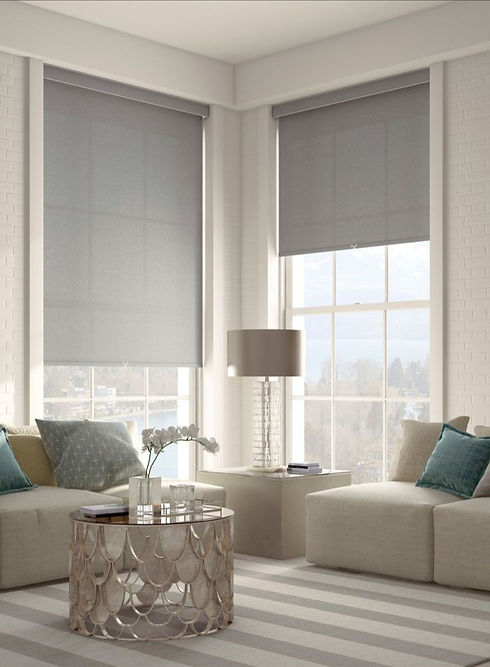
Locate an element on the screen. The width and height of the screenshot is (490, 667). lamp is located at coordinates (263, 356).